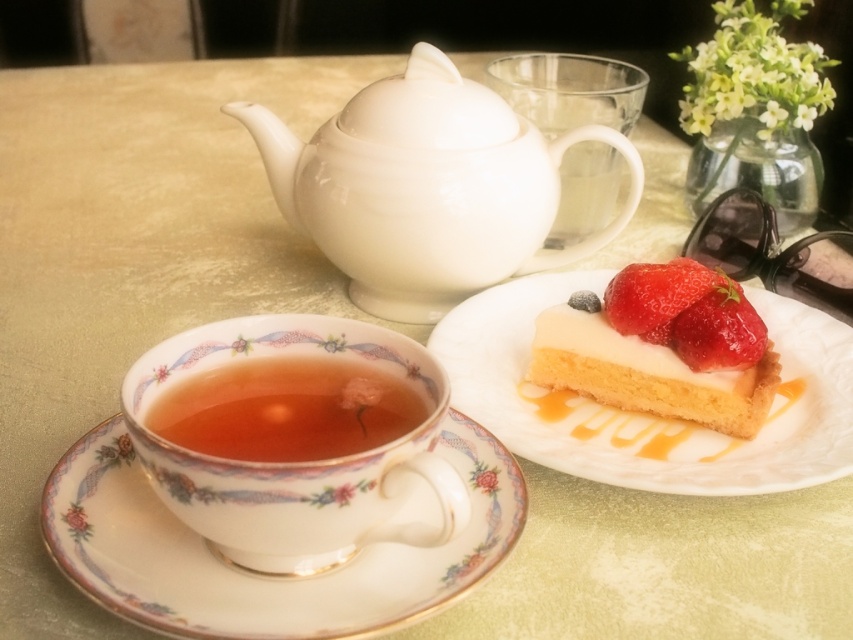
You are at a tea party and want to place a small sugar cube exactly halfway between the white teacup and the smooth cream cake with strawberries at right. Given the coordinates of the cake as point (647, 372), what are the coordinates of the sugar cube?

The coordinates of the sugar cube would be the midpoint between the teacup and the smooth cream cake with strawberries at right. Since the cake is at point (647, 372), the sugar cube should be placed at the midpoint coordinates between the teacup and this point.